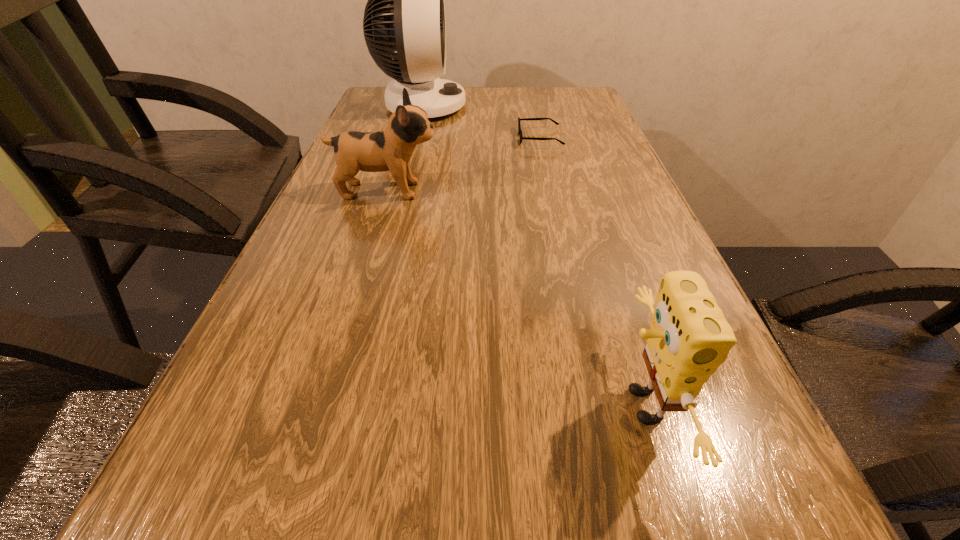
Locate an element on the screen. The width and height of the screenshot is (960, 540). vacant area between the sunglasses and the nearest object is located at coordinates (591, 272).

Find the location of a particular element. object that is the third closest to the tallest object is located at coordinates (689, 338).

Identify the location of the second closest object relative to the nearest object. (519, 127).